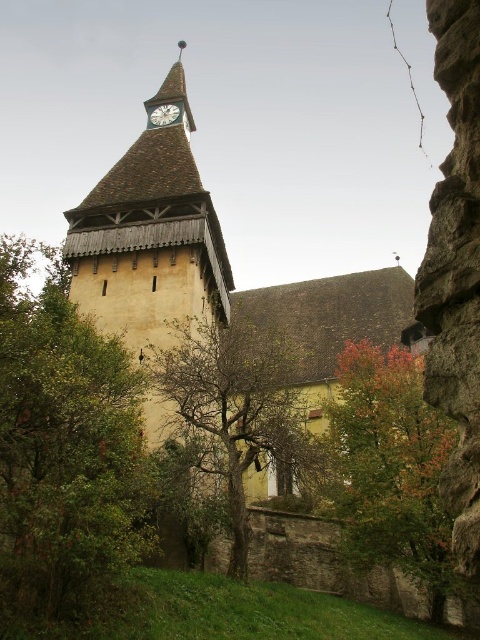
You are standing in front of the historic church and want to take a photo that includes both the green leafy tree at right and the green leafy tree at center. Which tree is closer to the right edge of the photo?

The green leafy tree at right is positioned on the right side of green leafy tree at center, so it is closer to the right edge of the photo.

You are standing at the center of the image and want to walk towards the green leafy tree at right. In which direction should you move?

Since the green leafy tree at right is located at coordinates approximately 0.730 on the x axis and 0.817 on the y axis, you should move towards the right and slightly upwards to reach it.